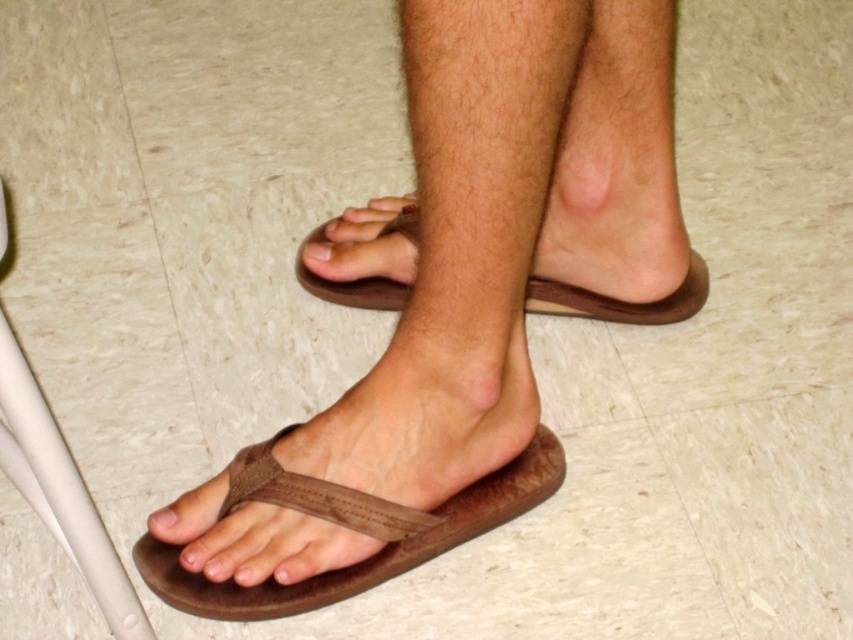
You are a delivery robot with a 21 inch wide package. You need to move from the brown leather sandal at center to the matte brown toe at lower left. Is there enough space for the package to fit through the gap between them?

The brown leather sandal at center is 20.95 inches away from the matte brown toe at lower left, so the 21 inch wide package is slightly wider than the gap. The package will not fit through the space between them.

You are a designer creating a floor plan for a bathroom. You need to place a small plant pot exactly at the center of the bathroom floor. The bathroom has a rectangular floor with dimensions 2 meters by 3 meters. The matte brown toe at lower left is currently at coordinates 0.814, 0.191 on the floor. Where should you place the plant pot to ensure it is centered?

The center of the bathroom floor would be at coordinates 1.5 meters in length and 1 meter in width. Since the matte brown toe at lower left is at coordinates (161, 520), the plant pot should be placed at the center point of the bathroom floor, which is 1.5 meters along the length and 1 meter along the width.

You are standing in a bathroom and see your two feet wearing flip flops. You want to step onto the tile that is directly to the right of the brown leather sandal at center. Can you step there without moving your other foot, which is wearing the matte brown toe at lower left?

The brown leather sandal at center is to the right of the matte brown toe at lower left, so stepping to the right of the brown leather sandal at center would require moving further away from the matte brown toe at lower left. Therefore, you cannot step onto that tile without moving your other foot.